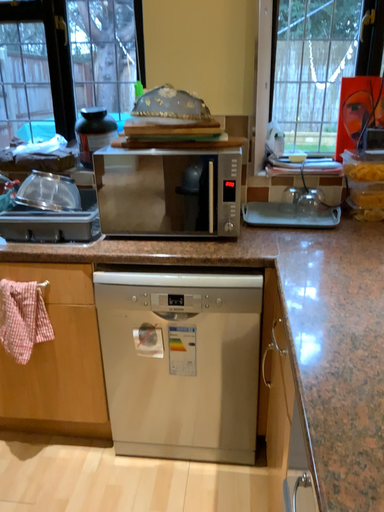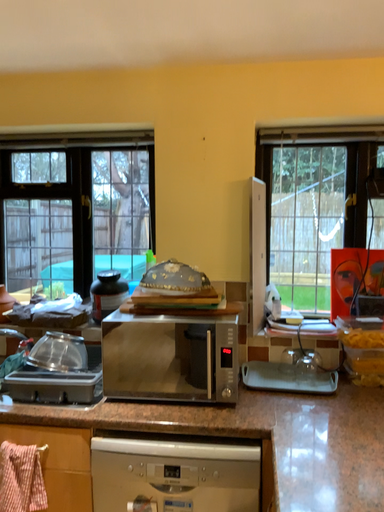
Question: How did the camera likely rotate when shooting the video?

Choices:
 (A) rotated upward
 (B) rotated downward

Answer: (A)